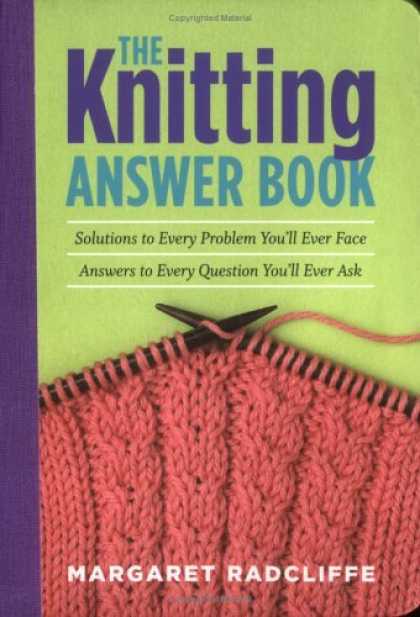
This screenshot has height=617, width=420. I want to click on cover of book, so click(89, 331), click(369, 26), click(401, 370).